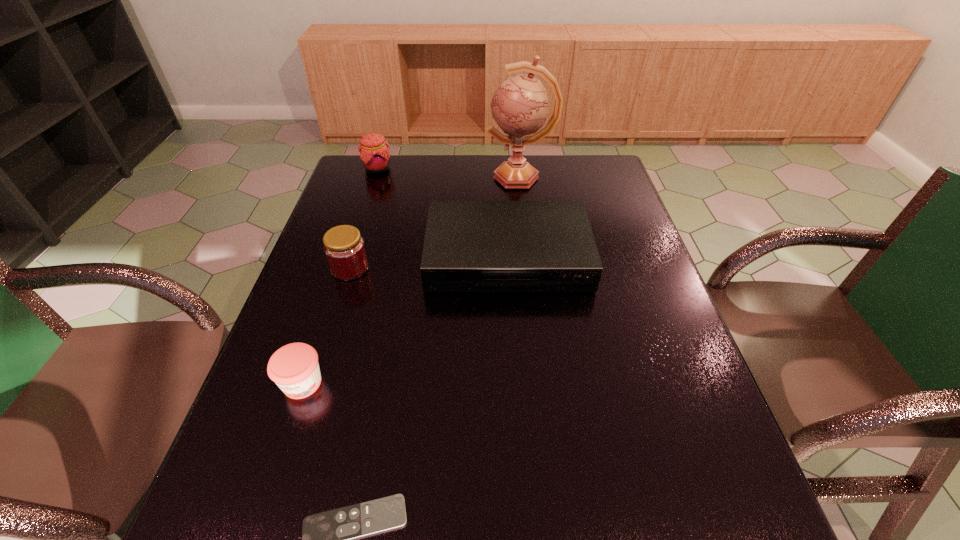
Find the location of a particular element. The width and height of the screenshot is (960, 540). vacant space that satisfies the following two spatial constraints: 1. on the front-facing side of the globe; 2. at the front of the CD player for disc insertion is located at coordinates (529, 257).